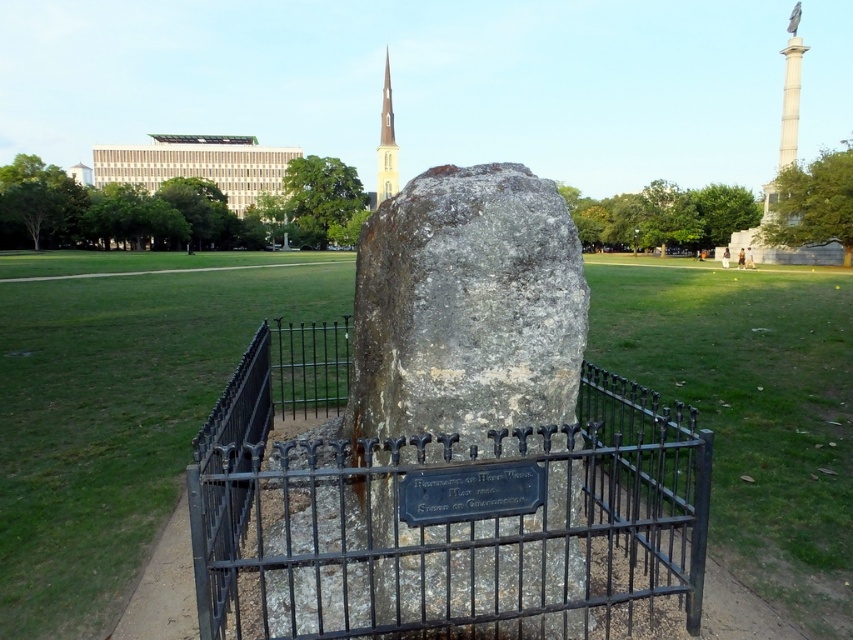
You are standing in the park looking at the monument. There are two points marked on the monument. Which point, point (297, 614) or point (378, 177), is closer to you?

Point (297, 614) is closer to you than point (378, 177).

You are standing in the park and see the black wrought iron fence at center and the gray stone at center. Which object is nearer to you?

The black wrought iron fence at center is closer to the viewer than the gray stone at center, so the black wrought iron fence at center is nearer to you.

You are a park visitor standing at the entrance, and you want to take a photo of the monument. The black wrought iron fence at center might block your view. Can you see the top of the smooth white spire at upper center over the fence?

The black wrought iron fence at center is not as tall as the smooth white spire at upper center, so yes, you can see the top of the smooth white spire at upper center over the fence.